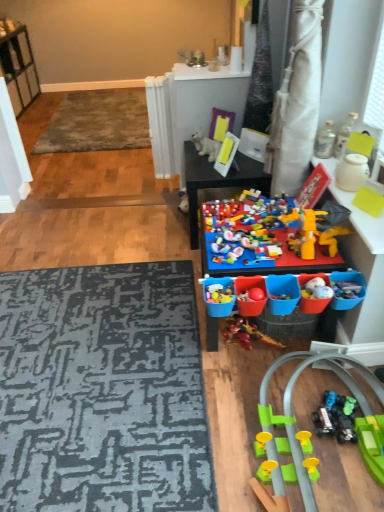
This screenshot has width=384, height=512. Identify the location of blank space above textured gray rug at upper left, the 1th mat viewed from the top (from a real-world perspective). (105, 104).